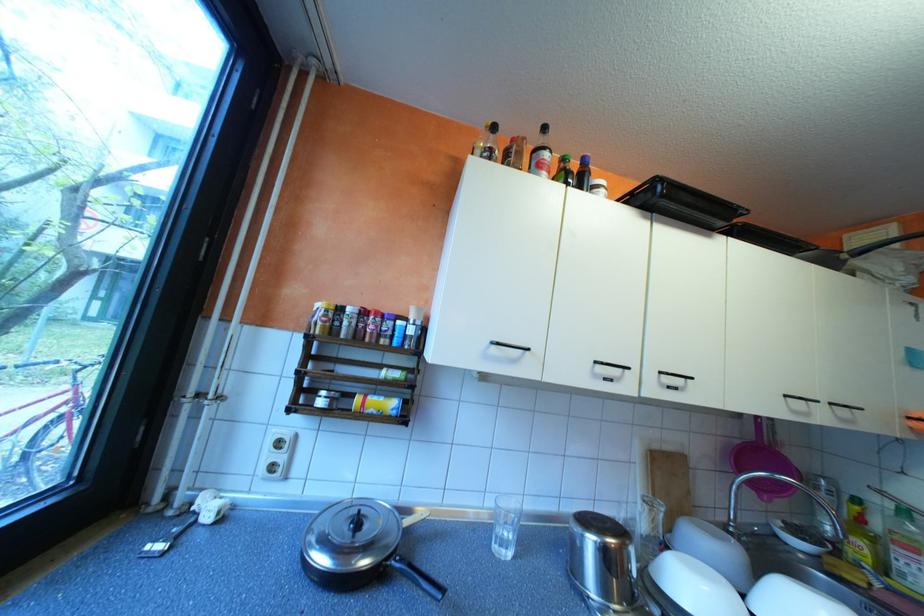
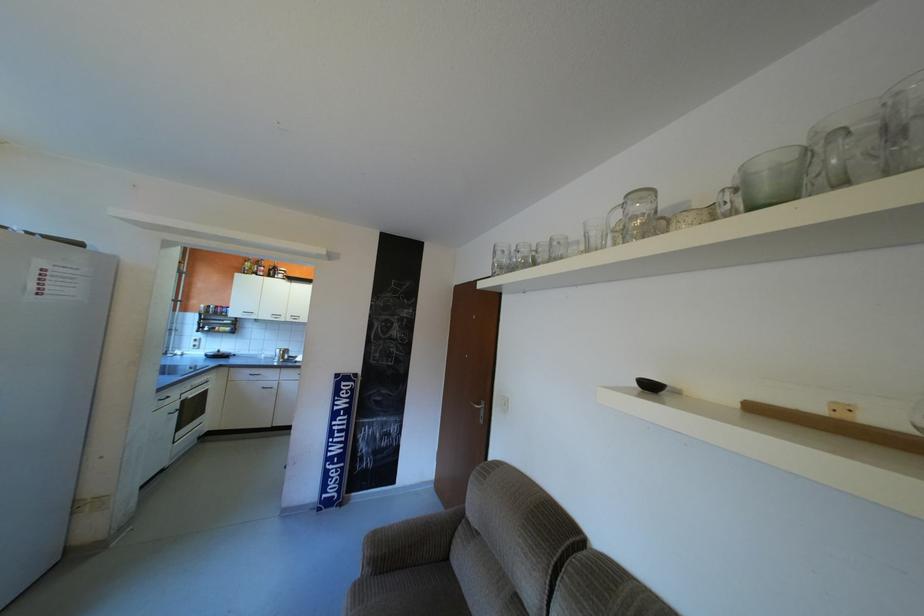
Find the pixel in the second image that matches point (664, 389) in the first image.

(300, 318)